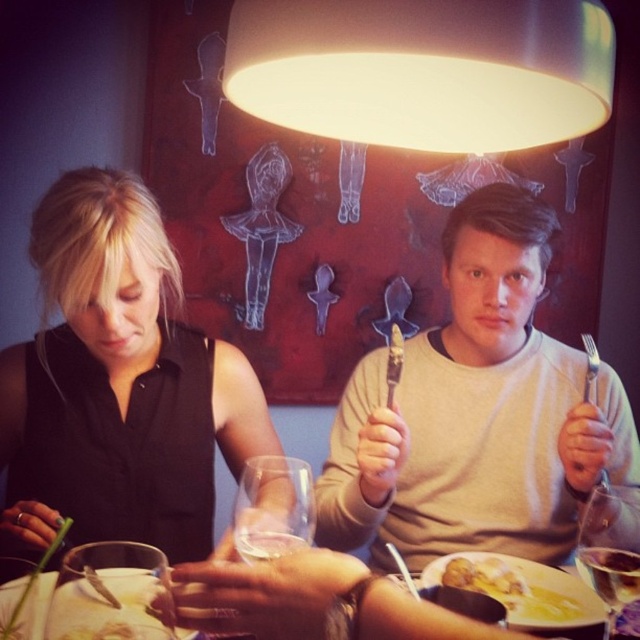
You are a photographer trying to capture a closeup of the transparent glass at lower right without the black matte dress at center blocking the view. Is this possible given their positions?

The black matte dress at center is further to the viewer than the transparent glass at lower right, so it would block the view of the transparent glass at lower right. Therefore, capturing a closeup without the dress blocking the glass is not possible.

You are a photographer taking a picture of the dining scene. You notice two points marked in the image. Which point, point (260,65) or point (621,596), is closer to your camera lens?

Point (260,65) is closer to the camera lens than point (621,596).